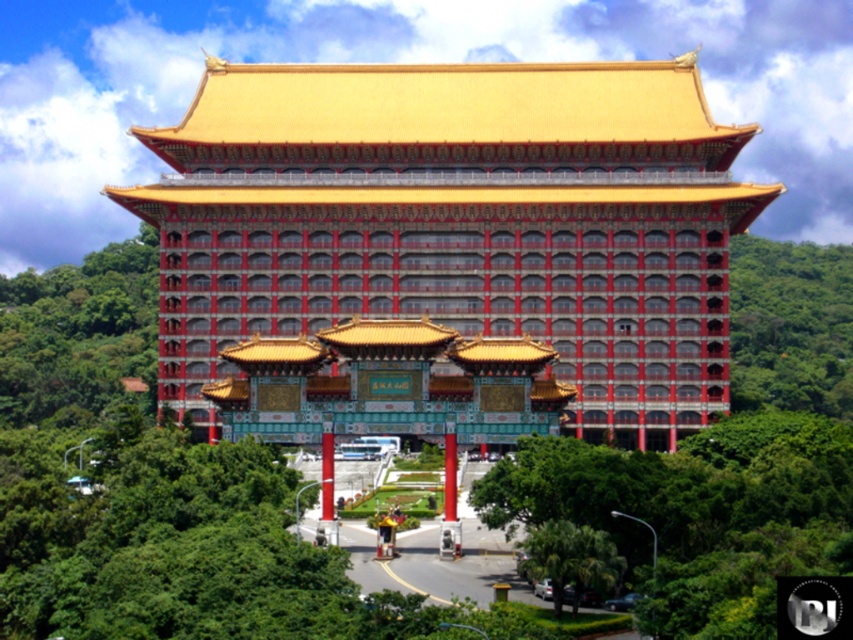
Question: In this image, where is polished gold gate at center located relative to red glossy pillar at center?

Choices:
 (A) above
 (B) below

Answer: (A)

Question: Which of the following is the closest to the observer?

Choices:
 (A) (782, 346)
 (B) (329, 440)
 (C) (315, 358)
 (D) (305, 304)

Answer: (C)

Question: Which point is closer to the camera taking this photo?

Choices:
 (A) (321, 460)
 (B) (581, 544)

Answer: (B)

Question: Observing the image, what is the correct spatial positioning of red glossy pillar at center in reference to smooth red pillar at center?

Choices:
 (A) left
 (B) right

Answer: (A)

Question: Which object is positioned closest to the polished gold gate at center?

Choices:
 (A) green leafy tree at lower center
 (B) red glossy pillar at center

Answer: (B)

Question: Is green leafy tree at lower center smaller than smooth red pillar at center?

Choices:
 (A) no
 (B) yes

Answer: (B)